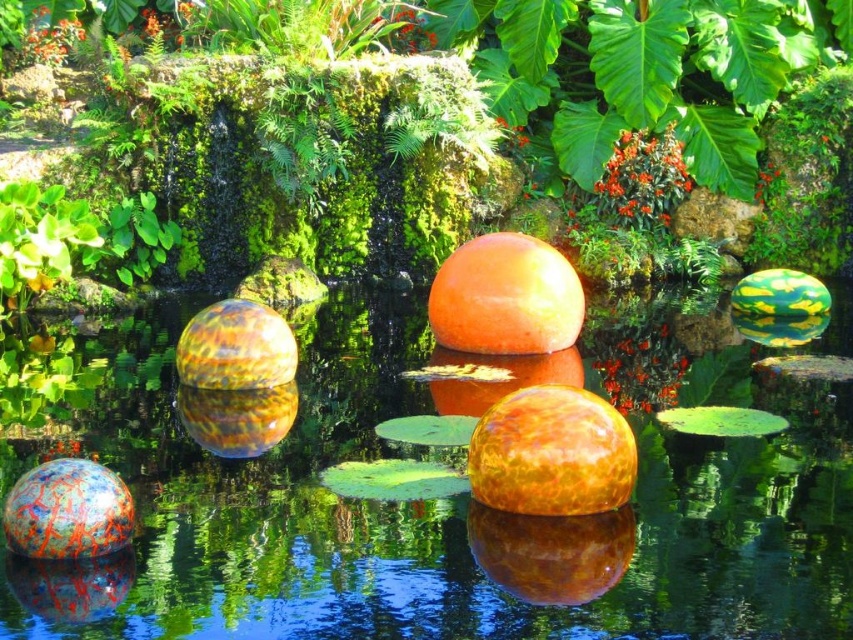
Question: Which of these objects is positioned farthest from the green matte leaf at upper left?

Choices:
 (A) translucent orange sphere at center
 (B) glossy orange sphere at center

Answer: (A)

Question: Which of the following is the farthest from the observer?

Choices:
 (A) (610, 573)
 (B) (120, 275)
 (C) (360, 452)

Answer: (B)

Question: Estimate the real-world distances between objects in this image. Which object is closer to the glossy orange sphere at center?

Choices:
 (A) translucent orange sphere at center
 (B) green matte leaf at upper left

Answer: (A)

Question: Is translucent orange sphere at center positioned at the back of green matte leaf at upper left?

Choices:
 (A) no
 (B) yes

Answer: (A)

Question: Is translucent orange sphere at center positioned at the back of green matte leaf at upper left?

Choices:
 (A) no
 (B) yes

Answer: (A)

Question: Can you confirm if translucent orange sphere at center is thinner than glossy orange sphere at center?

Choices:
 (A) no
 (B) yes

Answer: (A)